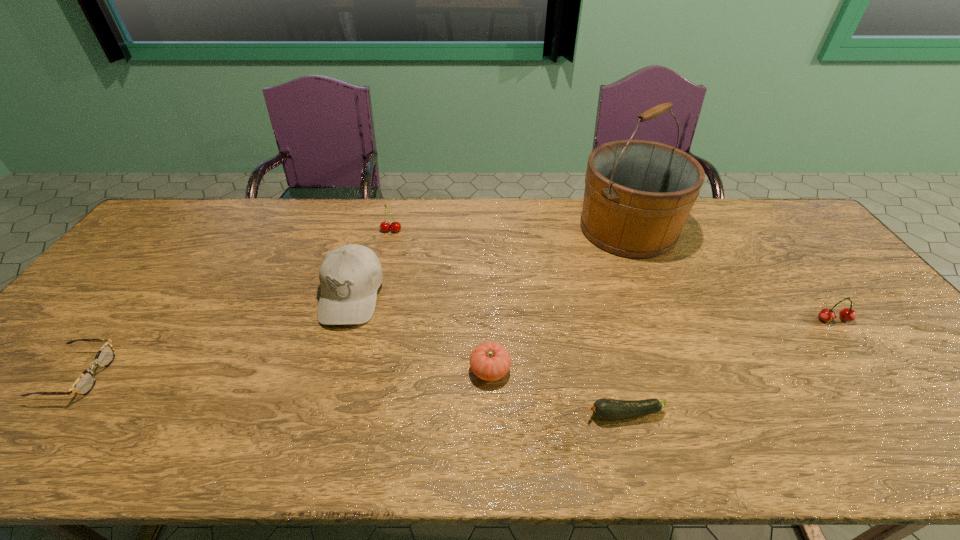
This screenshot has height=540, width=960. What are the coordinates of `free space located 0.060m on the front-facing side of the baseball cap` in the screenshot? It's located at (335, 349).

Locate an element on the screen. This screenshot has height=540, width=960. vacant space located 0.390m with the stems of the farther cherry pointing upwards is located at coordinates (369, 324).

Locate an element on the screen. The image size is (960, 540). free space located 0.230m with stems pointing upwards on the nearer cherry is located at coordinates (899, 403).

Where is `blank space located on the back of the fourth object from left to right`? blank space located on the back of the fourth object from left to right is located at coordinates (488, 251).

Find the location of `vacant space located on the frame of the leftmost object`. vacant space located on the frame of the leftmost object is located at coordinates (242, 375).

The width and height of the screenshot is (960, 540). Find the location of `vacant space situated 0.400m at the blossom end of the zucchini`. vacant space situated 0.400m at the blossom end of the zucchini is located at coordinates (403, 415).

Where is `vacant space located at the blossom end of the zucchini`? vacant space located at the blossom end of the zucchini is located at coordinates (548, 415).

Locate an element on the screen. This screenshot has height=540, width=960. blank space located at the blossom end of the zucchini is located at coordinates (440, 415).

What are the coordinates of `bucket that is at the far edge` in the screenshot? It's located at (638, 194).

Locate an element on the screen. cherry at the far edge is located at coordinates (385, 226).